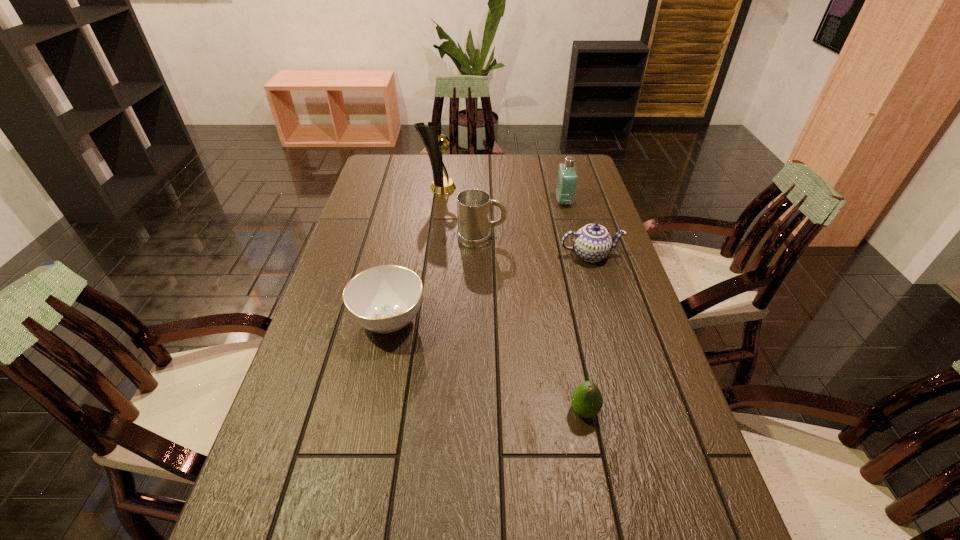
Identify the location of free point between the avocado and the nearer chinaware. The image size is (960, 540). (487, 366).

Image resolution: width=960 pixels, height=540 pixels. Find the location of `free space between the right chinaware and the tallest object`. free space between the right chinaware and the tallest object is located at coordinates (515, 221).

Identify the location of free spot between the right chinaware and the perfume. The image size is (960, 540). (577, 228).

Locate which object ranks in proximity to the nearest object. Please provide its 2D coordinates. Your answer should be formatted as a tuple, i.e. [(x, y)], where the tuple contains the x and y coordinates of a point satisfying the conditions above.

[(383, 299)]

The image size is (960, 540). I want to click on object that is the fourth nearest to the mug, so click(383, 299).

This screenshot has height=540, width=960. I want to click on free spot that satisfies the following two spatial constraints: 1. on the side of the nearest object with the handle; 2. on the left side of the third object from left to right, so click(x=482, y=411).

The height and width of the screenshot is (540, 960). What are the coordinates of `free region that satisfies the following two spatial constraints: 1. at the front of the award, where the globe is visible; 2. on the right side of the nearest object` in the screenshot? It's located at (408, 411).